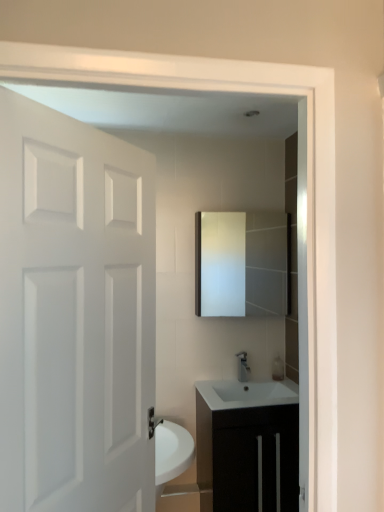
Question: Can you confirm if matte white mirror at center is positioned to the right of satin nickel faucet at center?

Choices:
 (A) yes
 (B) no

Answer: (B)

Question: Is matte white mirror at center further to the viewer compared to satin nickel faucet at center?

Choices:
 (A) yes
 (B) no

Answer: (B)

Question: Is matte white mirror at center facing away from satin nickel faucet at center?

Choices:
 (A) yes
 (B) no

Answer: (B)

Question: Can you confirm if matte white mirror at center is wider than satin nickel faucet at center?

Choices:
 (A) no
 (B) yes

Answer: (B)

Question: From the image's perspective, is matte white mirror at center on satin nickel faucet at center?

Choices:
 (A) yes
 (B) no

Answer: (A)

Question: From the image's perspective, would you say matte white mirror at center is shown under satin nickel faucet at center?

Choices:
 (A) no
 (B) yes

Answer: (A)

Question: Considering the relative sizes of black matte cabinet at lower center and matte white mirror at center in the image provided, is black matte cabinet at lower center thinner than matte white mirror at center?

Choices:
 (A) no
 (B) yes

Answer: (A)

Question: From the image's perspective, is black matte cabinet at lower center over matte white mirror at center?

Choices:
 (A) yes
 (B) no

Answer: (B)

Question: Can you confirm if black matte cabinet at lower center is smaller than matte white mirror at center?

Choices:
 (A) yes
 (B) no

Answer: (B)

Question: Is black matte cabinet at lower center oriented towards matte white mirror at center?

Choices:
 (A) no
 (B) yes

Answer: (A)

Question: Is black matte cabinet at lower center looking in the opposite direction of matte white mirror at center?

Choices:
 (A) yes
 (B) no

Answer: (B)

Question: Does black matte cabinet at lower center have a lesser height compared to matte white mirror at center?

Choices:
 (A) yes
 (B) no

Answer: (B)

Question: From a real-world perspective, does satin nickel faucet at center stand above white matte door at left?

Choices:
 (A) no
 (B) yes

Answer: (A)